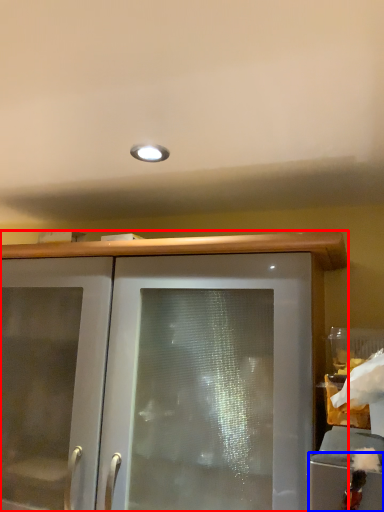
Question: Which point is further to the camera, cabinetry (highlighted by a red box) or cabinetry (highlighted by a blue box)?

Choices:
 (A) cabinetry
 (B) cabinetry

Answer: (A)